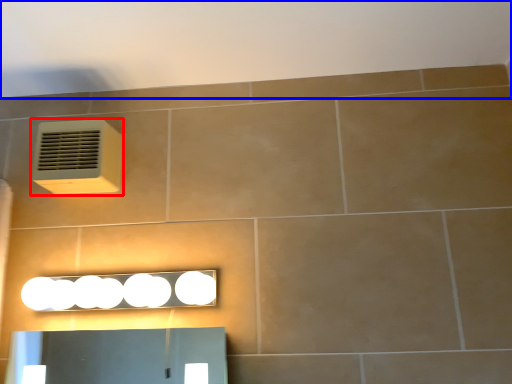
Question: Among these objects, which one is nearest to the camera, air conditioning (highlighted by a red box) or backdrop (highlighted by a blue box)?

Choices:
 (A) air conditioning
 (B) backdrop

Answer: (B)